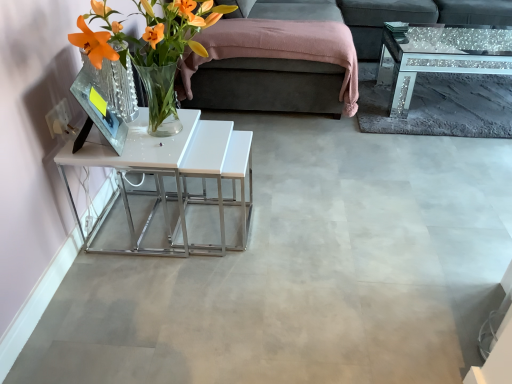
Find the location of a particular element. The width and height of the screenshot is (512, 384). dark gray fabric studio couch at upper center is located at coordinates (268, 85).

Describe the element at coordinates (268, 85) in the screenshot. I see `dark gray fabric studio couch at upper center` at that location.

This screenshot has width=512, height=384. I want to click on sparkly glass coffee table at upper right, so click(440, 57).

Considering the relative positions of dark gray fabric studio couch at upper center and sparkly glass coffee table at upper right in the image provided, is dark gray fabric studio couch at upper center behind sparkly glass coffee table at upper right?

No, it is not.

Looking at their sizes, would you say dark gray fabric studio couch at upper center is wider or thinner than sparkly glass coffee table at upper right?

Clearly, dark gray fabric studio couch at upper center has more width compared to sparkly glass coffee table at upper right.

Can we say dark gray fabric studio couch at upper center lies outside sparkly glass coffee table at upper right?

Yes, dark gray fabric studio couch at upper center is located beyond the bounds of sparkly glass coffee table at upper right.

Considering the positions of point (236, 107) and point (407, 111), is point (236, 107) closer or farther from the camera than point (407, 111)?

Point (236, 107).

Is white glossy table at left bigger or smaller than sparkly glass coffee table at upper right?

Clearly, white glossy table at left is smaller in size than sparkly glass coffee table at upper right.

Considering the relative sizes of white glossy table at left and sparkly glass coffee table at upper right in the image provided, is white glossy table at left wider than sparkly glass coffee table at upper right?

Indeed, white glossy table at left has a greater width compared to sparkly glass coffee table at upper right.

From the image's perspective, is white glossy table at left under sparkly glass coffee table at upper right?

Correct, white glossy table at left appears lower than sparkly glass coffee table at upper right in the image.

Which is further, [145,137] or [414,50]?

Positioned behind is point [414,50].

In the scene shown: From a real-world perspective, which is physically above, dark gray fabric couch at upper right or sparkly glass coffee table at upper right?

In real-world perspective, dark gray fabric couch at upper right is above.

Considering the positions of objects dark gray fabric couch at upper right and sparkly glass coffee table at upper right in the image provided, who is more to the left, dark gray fabric couch at upper right or sparkly glass coffee table at upper right?

From the viewer's perspective, sparkly glass coffee table at upper right appears more on the left side.

Locate an element on the screen. This screenshot has width=512, height=384. couch behind the sparkly glass coffee table at upper right is located at coordinates [x=416, y=17].

From the image's perspective, is dark gray fabric couch at upper right under sparkly glass coffee table at upper right?

Incorrect, from the image's perspective, dark gray fabric couch at upper right is higher than sparkly glass coffee table at upper right.

Considering the positions of objects dark gray fabric studio couch at upper center and translucent glass vase at left in the image provided, who is in front, dark gray fabric studio couch at upper center or translucent glass vase at left?

translucent glass vase at left.

Is translucent glass vase at left completely or partially inside dark gray fabric studio couch at upper center?

Actually, translucent glass vase at left is outside dark gray fabric studio couch at upper center.

Is dark gray fabric studio couch at upper center not near translucent glass vase at left?

Yes, dark gray fabric studio couch at upper center and translucent glass vase at left are located far from each other.

Would you say dark gray fabric studio couch at upper center is to the left or to the right of translucent glass vase at left in the picture?

Based on their positions, dark gray fabric studio couch at upper center is located to the right of translucent glass vase at left.

From a real-world perspective, who is located higher, dark gray fabric studio couch at upper center or dark gray fabric couch at upper right?

From a 3D spatial view, dark gray fabric studio couch at upper center is above.

Can you confirm if dark gray fabric studio couch at upper center is bigger than dark gray fabric couch at upper right?

Yes, dark gray fabric studio couch at upper center is bigger than dark gray fabric couch at upper right.

Which object is positioned more to the left, dark gray fabric studio couch at upper center or dark gray fabric couch at upper right?

dark gray fabric studio couch at upper center is more to the left.

Between dark gray fabric studio couch at upper center and dark gray fabric couch at upper right, which one has more height?

With more height is dark gray fabric studio couch at upper center.

Is white glossy table at left shorter than dark gray fabric couch at upper right?

Yes, white glossy table at left is shorter than dark gray fabric couch at upper right.

Could you tell me if white glossy table at left is turned towards dark gray fabric couch at upper right?

No, white glossy table at left does not turn towards dark gray fabric couch at upper right.

From the picture: Does white glossy table at left appear on the right side of dark gray fabric couch at upper right?

In fact, white glossy table at left is to the left of dark gray fabric couch at upper right.

In terms of width, does sparkly glass coffee table at upper right look wider or thinner when compared to translucent glass vase at left?

sparkly glass coffee table at upper right is wider than translucent glass vase at left.

Considering the sizes of objects sparkly glass coffee table at upper right and translucent glass vase at left in the image provided, who is taller, sparkly glass coffee table at upper right or translucent glass vase at left?

With more height is translucent glass vase at left.

Is sparkly glass coffee table at upper right facing towards translucent glass vase at left?

No.

This screenshot has width=512, height=384. Find the location of `floral arrangement that is in front of the sparkly glass coffee table at upper right`. floral arrangement that is in front of the sparkly glass coffee table at upper right is located at coordinates (151, 43).

This screenshot has height=384, width=512. I want to click on studio couch that appears in front of the sparkly glass coffee table at upper right, so click(268, 85).

Where is `table below the sparkly glass coffee table at upper right (from the image's perspective)`? Image resolution: width=512 pixels, height=384 pixels. table below the sparkly glass coffee table at upper right (from the image's perspective) is located at coordinates (174, 175).

Estimate the real-world distances between objects in this image. Which object is closer to sparkly glass coffee table at upper right, white glossy table at left or translucent glass vase at left?

The object closer to sparkly glass coffee table at upper right is white glossy table at left.

When comparing their distances from white glossy table at left, does dark gray fabric studio couch at upper center or dark gray fabric couch at upper right seem closer?

dark gray fabric studio couch at upper center is closer to white glossy table at left.

Based on their spatial positions, is dark gray fabric studio couch at upper center or dark gray fabric couch at upper right further from sparkly glass coffee table at upper right?

dark gray fabric studio couch at upper center is further to sparkly glass coffee table at upper right.

Considering their positions, is sparkly glass coffee table at upper right positioned further to white glossy table at left than translucent glass vase at left?

sparkly glass coffee table at upper right is positioned further to the anchor white glossy table at left.

Looking at this image, which object lies further to the anchor point dark gray fabric studio couch at upper center, white glossy table at left or translucent glass vase at left?

translucent glass vase at left lies further to dark gray fabric studio couch at upper center than the other object.

Looking at this image, looking at the image, which one is located further to white glossy table at left, translucent glass vase at left or dark gray fabric couch at upper right?

dark gray fabric couch at upper right is further to white glossy table at left.

Looking at the image, which one is located closer to dark gray fabric couch at upper right, dark gray fabric studio couch at upper center or translucent glass vase at left?

dark gray fabric studio couch at upper center.

When comparing their distances from sparkly glass coffee table at upper right, does translucent glass vase at left or white glossy table at left seem closer?

white glossy table at left is closer to sparkly glass coffee table at upper right.

Image resolution: width=512 pixels, height=384 pixels. In order to click on studio couch located between white glossy table at left and dark gray fabric couch at upper right in the left-right direction in this screenshot , I will do `click(268, 85)`.

I want to click on floral arrangement situated between white glossy table at left and dark gray fabric couch at upper right from left to right, so click(x=151, y=43).

Identify the location of coffee table situated between translucent glass vase at left and dark gray fabric couch at upper right from left to right. The image size is (512, 384). (440, 57).

Where is `studio couch between white glossy table at left and sparkly glass coffee table at upper right`? The width and height of the screenshot is (512, 384). studio couch between white glossy table at left and sparkly glass coffee table at upper right is located at coordinates (268, 85).